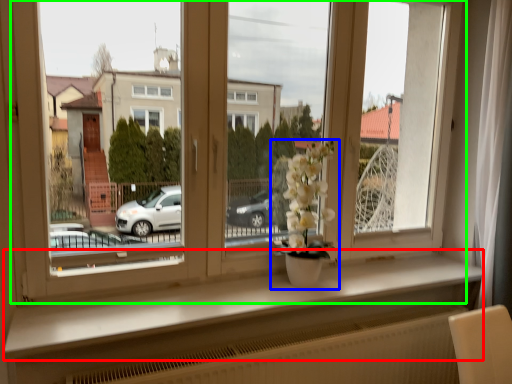
Question: Based on their relative distances, which object is nearer to window sill (highlighted by a red box)? Choose from houseplant (highlighted by a blue box) and window (highlighted by a green box).

Choices:
 (A) houseplant
 (B) window

Answer: (A)